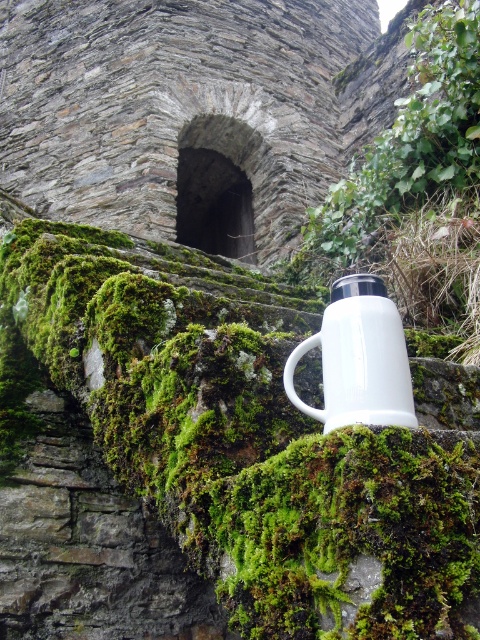
Question: Does green mossy stone at upper center appear on the left side of white enamel mug at center?

Choices:
 (A) yes
 (B) no

Answer: (A)

Question: Where is green mossy stone at upper center located in relation to white enamel mug at center in the image?

Choices:
 (A) above
 (B) below

Answer: (B)

Question: Can you confirm if green mossy stone at upper center is positioned to the right of white enamel mug at center?

Choices:
 (A) no
 (B) yes

Answer: (A)